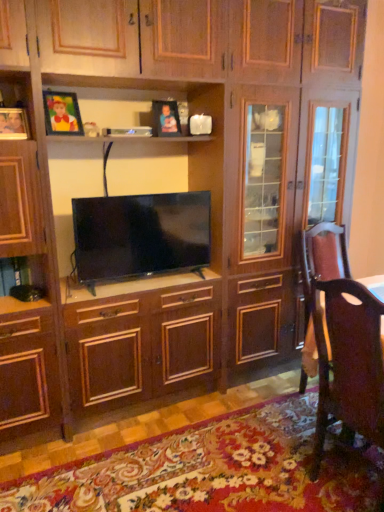
Question: Can you confirm if matte black tv at center is thinner than matte plastic picture frame at upper center, positioned as the third picture frame in front-to-back order?

Choices:
 (A) yes
 (B) no

Answer: (B)

Question: Can you confirm if matte black tv at center is smaller than matte plastic picture frame at upper center, the 1th picture frame when ordered from back to front?

Choices:
 (A) yes
 (B) no

Answer: (B)

Question: Is matte black tv at center positioned beyond the bounds of matte plastic picture frame at upper center, positioned as the third picture frame in front-to-back order?

Choices:
 (A) yes
 (B) no

Answer: (A)

Question: From a real-world perspective, is matte black tv at center below matte plastic picture frame at upper center, arranged as the first picture frame when viewed from the right?

Choices:
 (A) yes
 (B) no

Answer: (A)

Question: Could you tell me if matte black tv at center is facing matte plastic picture frame at upper center, arranged as the first picture frame when viewed from the right?

Choices:
 (A) no
 (B) yes

Answer: (A)

Question: Is point (317, 265) positioned closer to the camera than point (340, 366)?

Choices:
 (A) farther
 (B) closer

Answer: (A)

Question: Is brown leather swivel chair at right in front of or behind brown leather chair at lower right in the image?

Choices:
 (A) behind
 (B) front

Answer: (A)

Question: Considering the positions of brown leather swivel chair at right and brown leather chair at lower right in the image, is brown leather swivel chair at right taller or shorter than brown leather chair at lower right?

Choices:
 (A) tall
 (B) short

Answer: (A)

Question: Considering the positions of brown leather swivel chair at right and brown leather chair at lower right in the image, is brown leather swivel chair at right bigger or smaller than brown leather chair at lower right?

Choices:
 (A) small
 (B) big

Answer: (B)

Question: Based on their sizes in the image, would you say matte wooden picture frame at upper left, the first picture frame when ordered from left to right, is bigger or smaller than brown leather chair at lower right?

Choices:
 (A) big
 (B) small

Answer: (B)

Question: Visually, is matte wooden picture frame at upper left, the first picture frame from the front, positioned to the left or to the right of brown leather chair at lower right?

Choices:
 (A) right
 (B) left

Answer: (B)

Question: Considering the positions of point (4, 119) and point (344, 357), is point (4, 119) closer or farther from the camera than point (344, 357)?

Choices:
 (A) farther
 (B) closer

Answer: (A)

Question: From the image's perspective, is matte wooden picture frame at upper left, acting as the 3th picture frame starting from the right, located above or below brown leather chair at lower right?

Choices:
 (A) above
 (B) below

Answer: (A)

Question: Is matte wooden picture frame at upper left, acting as the 2th picture frame starting from the back, inside or outside of matte wooden picture frame at upper left, the first picture frame when ordered from left to right?

Choices:
 (A) inside
 (B) outside

Answer: (B)

Question: From a real-world perspective, relative to matte wooden picture frame at upper left, arranged as the third picture frame when viewed from the back, is matte wooden picture frame at upper left, the second picture frame when ordered from right to left, vertically above or below?

Choices:
 (A) above
 (B) below

Answer: (A)